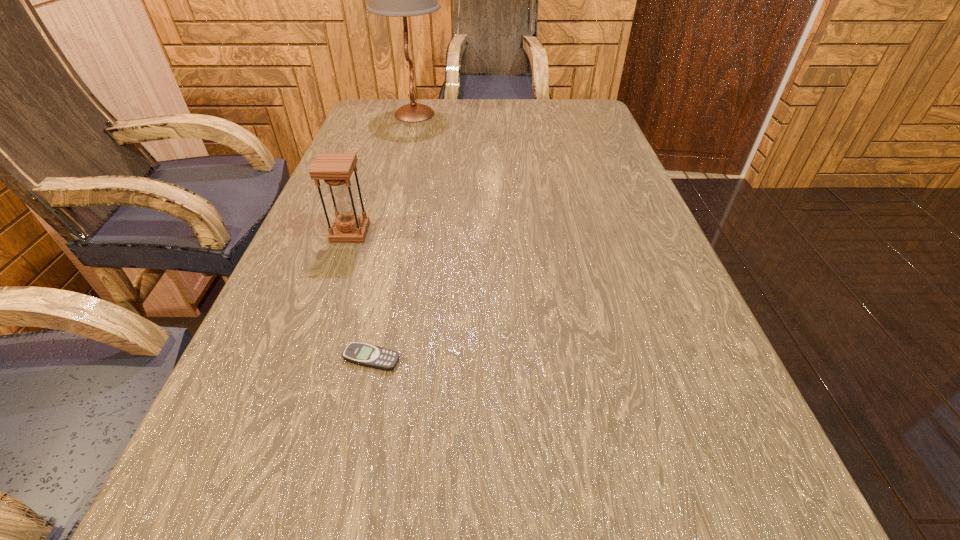
Where is `table lamp located at the left edge`? table lamp located at the left edge is located at coordinates (403, 0).

The width and height of the screenshot is (960, 540). In order to click on hourglass positioned at the left edge in this screenshot , I will do `click(336, 169)`.

Identify the location of beeper present at the left edge. This screenshot has width=960, height=540. (363, 354).

Locate an element on the screen. Image resolution: width=960 pixels, height=540 pixels. object that is at the far left corner is located at coordinates (403, 0).

Locate an element on the screen. This screenshot has height=540, width=960. free point at the far edge is located at coordinates (495, 103).

The height and width of the screenshot is (540, 960). What are the coordinates of `free space at the left edge` in the screenshot? It's located at (287, 264).

Locate an element on the screen. The image size is (960, 540). vacant space at the right edge of the desktop is located at coordinates (678, 287).

I want to click on free space at the far left corner of the desktop, so pyautogui.click(x=366, y=120).

Find the location of a particular element. vacant space at the far right corner of the desktop is located at coordinates (549, 119).

Identify the location of vacant region between the second shortest object and the farthest object. The width and height of the screenshot is (960, 540). pos(382,173).